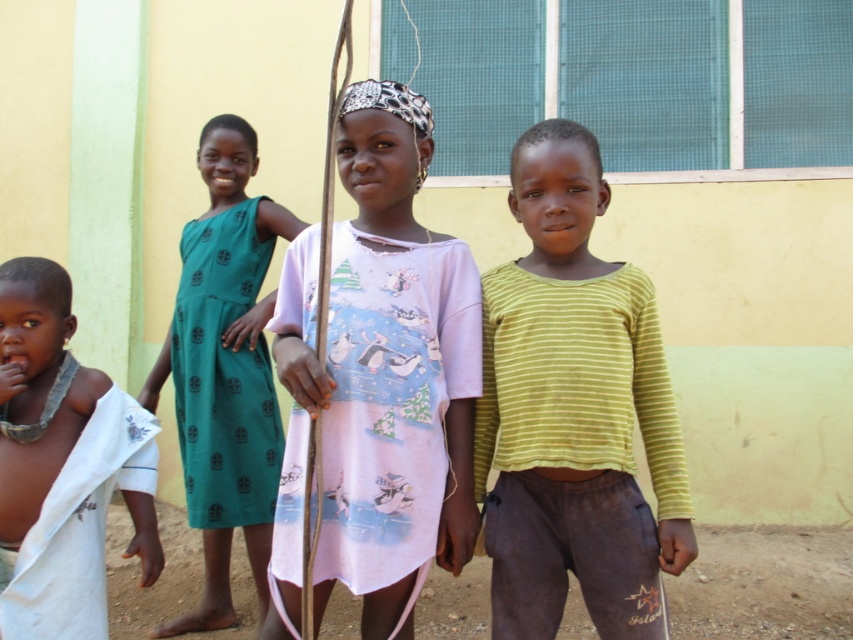
You are a photographer trying to capture a clear shot of the pink cotton dress at center and the white cloth at left. Which object should you focus on first to ensure both are in focus?

The pink cotton dress at center is closer to the viewer than the white cloth at left. To ensure both are in focus, you should focus on the pink cotton dress at center first, as it is closer, and the depth of field will naturally include the white cloth at left in the background.

You are standing in front of the building with a yellow wall and green vertical accents. There is a point at coordinates (225, 371). What object is located at this point?

The point at (225, 371) is where the green printed dress at left is located.